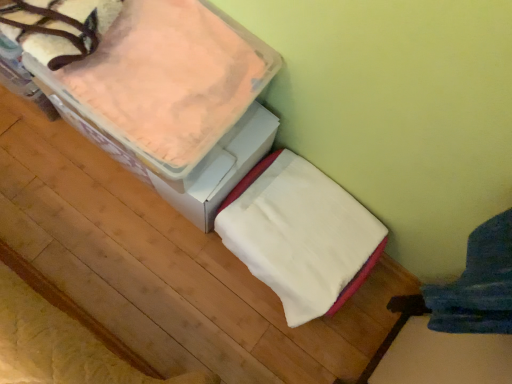
Measure the distance between point (134, 117) and camera.

Point (134, 117) is 32.05 inches away from camera.

What do you see at coordinates (167, 78) in the screenshot? I see `pink fleece blanket at upper left` at bounding box center [167, 78].

You are a GUI agent. You are given a task and a screenshot of the screen. Output one action in this format:
    pyautogui.click(x=<x>, y=<y>)
    Task: Click on the pink fleece blanket at upper left
    This screenshot has width=512, height=384.
    Given the screenshot: What is the action you would take?
    click(x=167, y=78)

In order to face pink fleece blanket at upper left, should I rotate leftwards or rightwards?

Rotate left and turn 13.067 degrees.

The image size is (512, 384). What do you see at coordinates (300, 235) in the screenshot?
I see `white soft blanket at center` at bounding box center [300, 235].

Where is `white soft blanket at center`? white soft blanket at center is located at coordinates (300, 235).

I want to click on pink fleece blanket at upper left, so click(x=167, y=78).

Which is more to the left, white soft blanket at center or pink fleece blanket at upper left?

pink fleece blanket at upper left is more to the left.

Consider the image. Considering the relative positions of white soft blanket at center and pink fleece blanket at upper left in the image provided, is white soft blanket at center behind pink fleece blanket at upper left?

Yes, white soft blanket at center is further from the camera.

Does point (276, 287) lie behind point (146, 57)?

Yes, it is behind point (146, 57).

Consider the image. From the image's perspective, which object appears higher, white soft blanket at center or pink fleece blanket at upper left?

From the image's view, pink fleece blanket at upper left is above.

From a real-world perspective, is white soft blanket at center under pink fleece blanket at upper left?

Yes, from a real-world perspective, white soft blanket at center is under pink fleece blanket at upper left.

Which of these two, white soft blanket at center or pink fleece blanket at upper left, is thinner?

Thinner between the two is white soft blanket at center.

In terms of height, does white soft blanket at center look taller or shorter compared to pink fleece blanket at upper left?

white soft blanket at center is taller than pink fleece blanket at upper left.

Considering the sizes of white soft blanket at center and pink fleece blanket at upper left in the image, is white soft blanket at center bigger or smaller than pink fleece blanket at upper left?

Clearly, white soft blanket at center is larger in size than pink fleece blanket at upper left.

Looking at this image, is white soft blanket at center surrounding pink fleece blanket at upper left?

No, pink fleece blanket at upper left is not surrounded by white soft blanket at center.

Is white soft blanket at center not close to pink fleece blanket at upper left?

No, white soft blanket at center is not far away from pink fleece blanket at upper left.

Is white soft blanket at center looking in the opposite direction of pink fleece blanket at upper left?

white soft blanket at center does not have its back to pink fleece blanket at upper left.

Can you tell me how much white soft blanket at center and pink fleece blanket at upper left differ in facing direction?

white soft blanket at center and pink fleece blanket at upper left are facing 0.000256 degrees away from each other.

How distant is white soft blanket at center from pink fleece blanket at upper left?

A distance of 13.81 inches exists between white soft blanket at center and pink fleece blanket at upper left.

Locate an element on the screen. The width and height of the screenshot is (512, 384). sheet that appears in front of the white soft blanket at center is located at coordinates (167, 78).

Considering the positions of objects pink fleece blanket at upper left and white soft blanket at center in the image provided, who is more to the right, pink fleece blanket at upper left or white soft blanket at center?

white soft blanket at center.

Is pink fleece blanket at upper left closer to camera compared to white soft blanket at center?

Yes, it is in front of white soft blanket at center.

Does point (73, 74) appear closer or farther from the camera than point (381, 239)?

Point (73, 74) is closer to the camera than point (381, 239).

From the image's perspective, between pink fleece blanket at upper left and white soft blanket at center, who is located below?

white soft blanket at center is shown below in the image.

From a real-world perspective, which object rests below the other?

white soft blanket at center, from a real-world perspective.

Considering the sizes of pink fleece blanket at upper left and white soft blanket at center in the image, is pink fleece blanket at upper left wider or thinner than white soft blanket at center?

Clearly, pink fleece blanket at upper left has more width compared to white soft blanket at center.

Which of these two, pink fleece blanket at upper left or white soft blanket at center, stands shorter?

Standing shorter between the two is pink fleece blanket at upper left.

Can you confirm if pink fleece blanket at upper left is bigger than white soft blanket at center?

Incorrect, pink fleece blanket at upper left is not larger than white soft blanket at center.

Would you say pink fleece blanket at upper left contains white soft blanket at center?

No, pink fleece blanket at upper left does not contain white soft blanket at center.

Is pink fleece blanket at upper left not close to white soft blanket at center?

No.

Is pink fleece blanket at upper left turned away from white soft blanket at center?

No, pink fleece blanket at upper left is not facing away from white soft blanket at center.

At what (x,y) coordinates should I click in order to perform the action: click on blanket below the pink fleece blanket at upper left (from a real-world perspective). Please return your answer as a coordinate pair (x, y). The height and width of the screenshot is (384, 512). Looking at the image, I should click on (300, 235).

The height and width of the screenshot is (384, 512). What are the coordinates of `sheet located in front of the white soft blanket at center` in the screenshot? It's located at (167, 78).

Where is `sheet above the white soft blanket at center (from a real-world perspective)`? sheet above the white soft blanket at center (from a real-world perspective) is located at coordinates (167, 78).